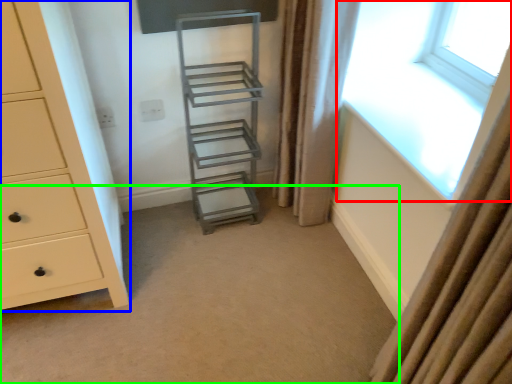
Question: Based on their relative distances, which object is farther from window (highlighted by a red box)? Choose from chest of drawers (highlighted by a blue box) and plain (highlighted by a green box).

Choices:
 (A) chest of drawers
 (B) plain

Answer: (A)